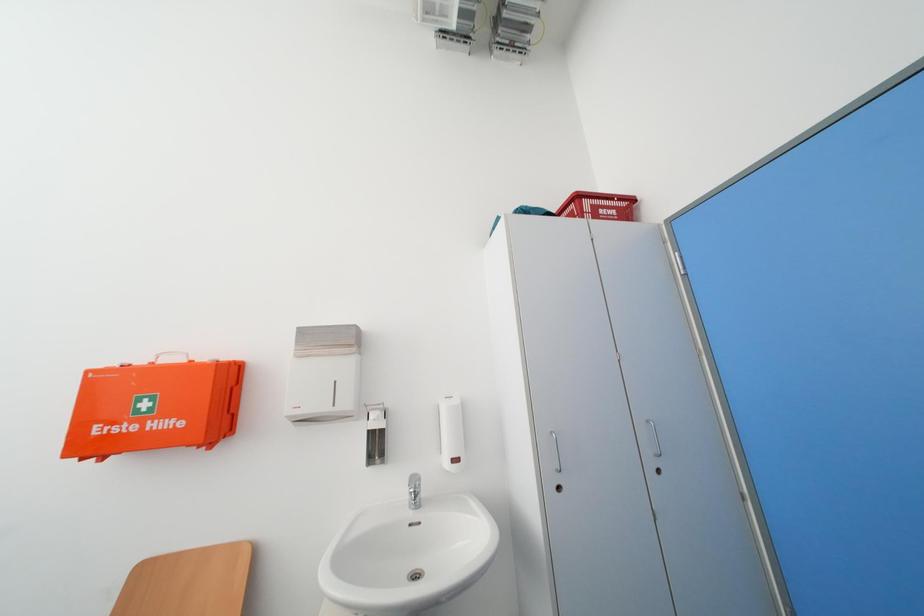
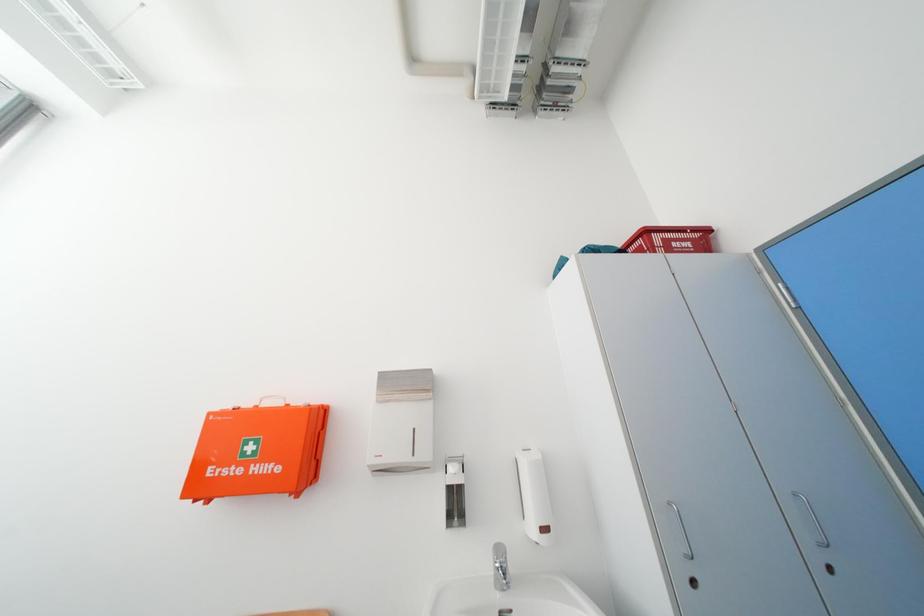
Question: The images are taken continuously from a first-person perspective. In which direction are you moving?

Choices:
 (A) Left
 (B) Right
 (C) Forward
 (D) Backward

Answer: (A)